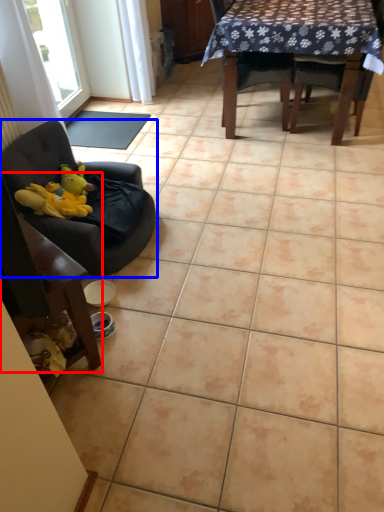
Question: Which object appears closest to the camera in this image, chair (highlighted by a red box) or chair (highlighted by a blue box)?

Choices:
 (A) chair
 (B) chair

Answer: (A)